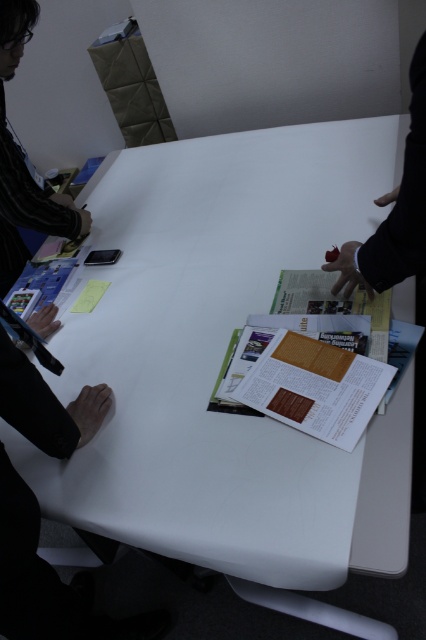
You are standing in front of a conference table with two points marked on it. The first point is at coordinates point (x=419, y=200) and the second is at point (x=3, y=74). Which point is closer to you?

Point (x=419, y=200) is closer to the viewer than point (x=3, y=74).

You are organizing materials on a table for a presentation. You have a white glossy paper at center and a striped shirt at left. Which object is shorter in height?

The white glossy paper at center has a lesser height compared to striped shirt at left, so the white glossy paper at center is shorter in height.

You are organizing a meeting and need to place a new folder on the table. The folder is the same size as the striped shirt at left. Can the white glossy paper at center fit entirely under the folder?

The white glossy paper at center is smaller than the striped shirt at left. Since the folder is the same size as the striped shirt at left, the white glossy paper at center can fit entirely under the folder.